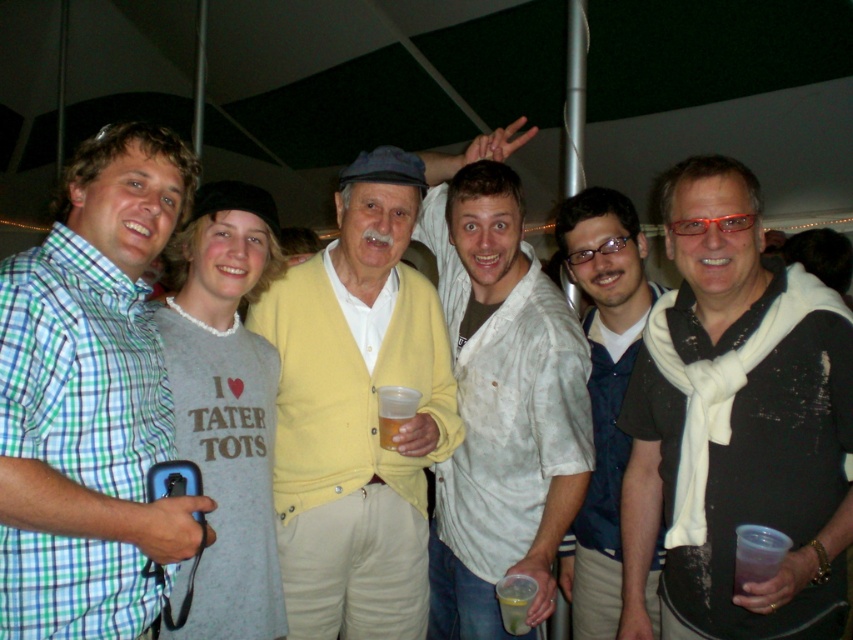
Question: Which of the following is the closest to the observer?

Choices:
 (A) white cotton shirt at center
 (B) black textured scarf at right
 (C) translucent plastic cup at center

Answer: (B)

Question: Which point is closer to the camera?

Choices:
 (A) white cotton shirt at center
 (B) yellow cardigan at center
 (C) black textured scarf at right

Answer: (C)

Question: Does yellow cardigan at center have a smaller size compared to white cotton shirt at center?

Choices:
 (A) no
 (B) yes

Answer: (B)

Question: Is green checkered shirt at left below translucent plastic cup at center?

Choices:
 (A) yes
 (B) no

Answer: (B)

Question: Can you confirm if black textured scarf at right is positioned to the left of white cotton shirt at center?

Choices:
 (A) no
 (B) yes

Answer: (A)

Question: Estimate the real-world distances between objects in this image. Which object is closer to the white matte scarf at center?

Choices:
 (A) yellow cardigan at center
 (B) translucent plastic cup at center

Answer: (A)